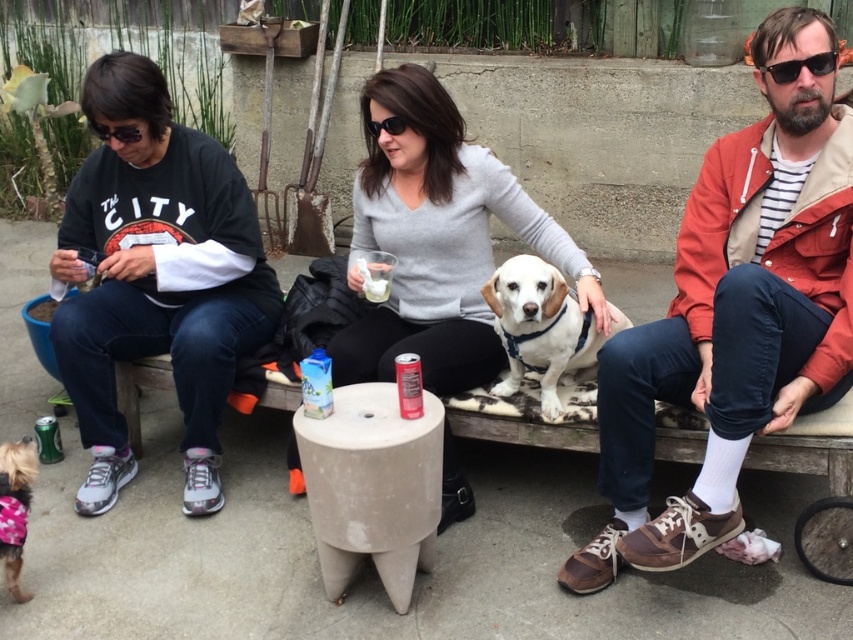
You are at a backyard gathering and want to place a hat between the red leather jacket at right and the sunglasses at upper right. Where should you put it?

Place the hat between the red leather jacket at right and the sunglasses at upper right, ensuring it is to the right of the red leather jacket at right and to the left of the sunglasses at upper right since the red leather jacket at right is positioned to the left of the sunglasses at upper right.

You are a photographer trying to capture the white soft fur dog at center. You notice the black cotton shirt at left is blocking your view. Can you move the shirt to get a clear shot of the dog?

The black cotton shirt at left is located above the white soft fur dog at center, so moving the shirt would allow you to see the dog clearly.